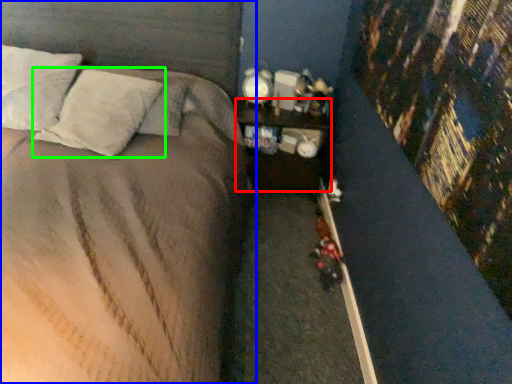
Question: Which is farther away from nightstand (highlighted by a red box)? bed (highlighted by a blue box) or pillow (highlighted by a green box)?

Choices:
 (A) bed
 (B) pillow

Answer: (B)